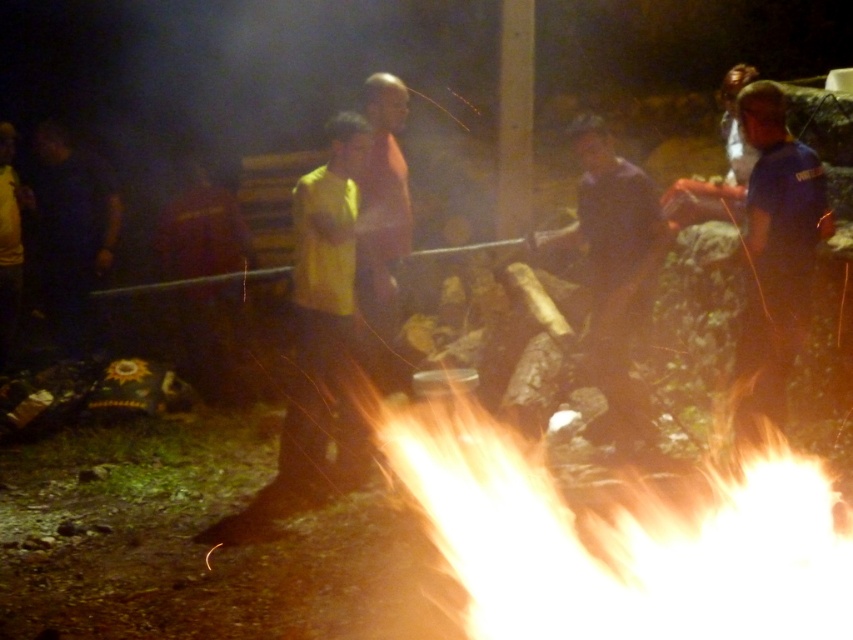
Is point (341, 355) behind point (68, 339)?

No, (341, 355) is closer to viewer.

Between yellow matte shirt at center and dark blue fabric at left, which one appears on the right side from the viewer's perspective?

yellow matte shirt at center is more to the right.

Locate an element on the screen. yellow matte shirt at center is located at coordinates (326, 317).

Locate an element on the screen. This screenshot has height=640, width=853. yellow matte shirt at center is located at coordinates (326, 317).

What do you see at coordinates (616, 544) in the screenshot? I see `bright orange flames at center` at bounding box center [616, 544].

Between bright orange flames at center and blue cotton shirt at right, which one appears on the right side from the viewer's perspective?

Positioned to the right is blue cotton shirt at right.

The image size is (853, 640). Describe the element at coordinates (616, 544) in the screenshot. I see `bright orange flames at center` at that location.

Where is `bright orange flames at center`? Image resolution: width=853 pixels, height=640 pixels. bright orange flames at center is located at coordinates (x=616, y=544).

Is point (788, 369) closer to camera compared to point (601, 182)?

Yes, point (788, 369) is in front of point (601, 182).

Is blue cotton shirt at right to the right of dark brown wood at center from the viewer's perspective?

Correct, you'll find blue cotton shirt at right to the right of dark brown wood at center.

Which is in front, point (775, 404) or point (636, 220)?

Positioned in front is point (775, 404).

This screenshot has width=853, height=640. I want to click on blue cotton shirt at right, so click(775, 253).